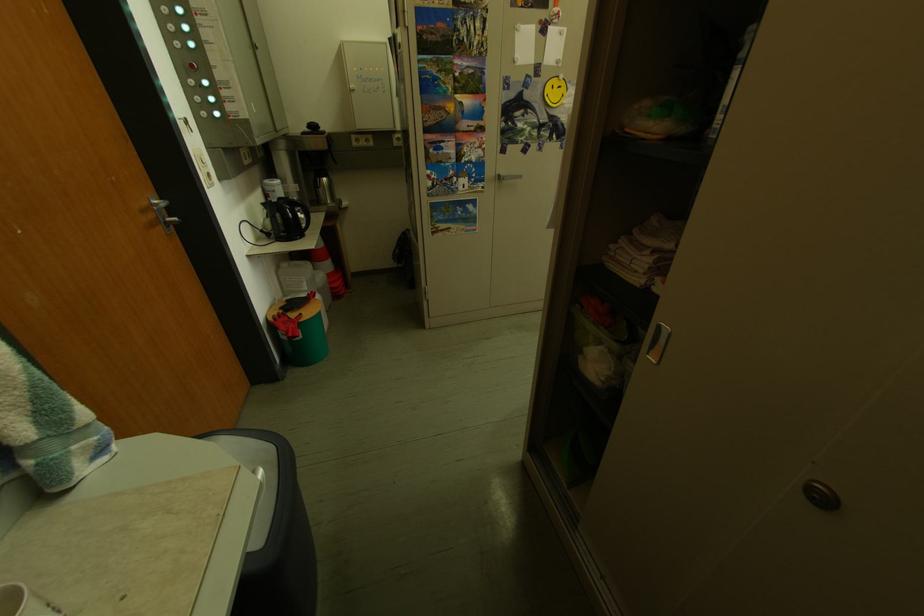
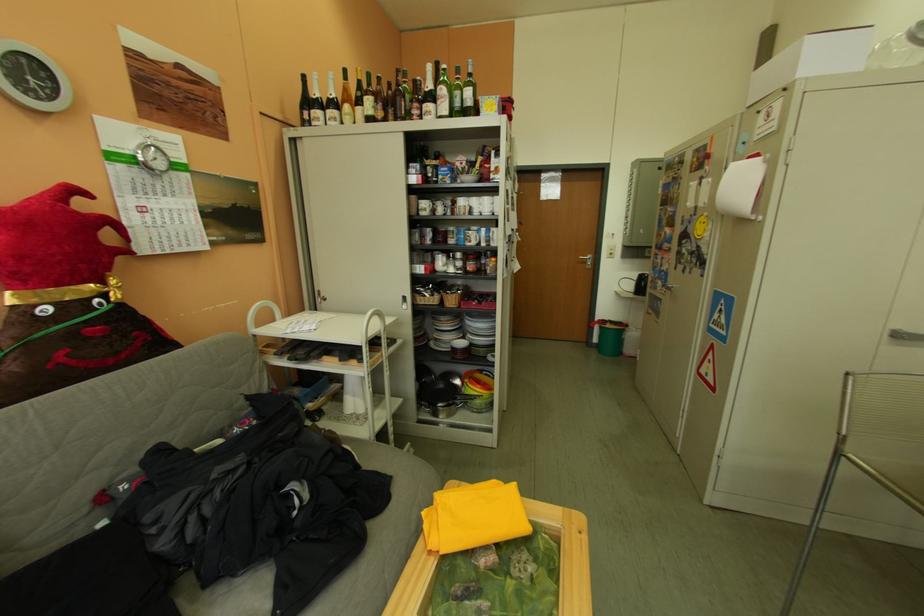
Find the pixel in the second image that matches (x=574, y=63) in the first image.

(720, 204)